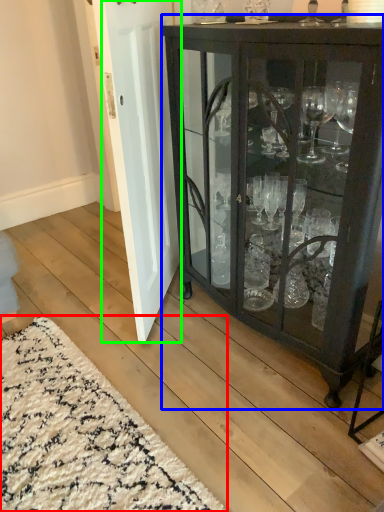
Question: Based on their relative distances, which object is farther from doormat (highlighted by a red box)? Choose from cupboard (highlighted by a blue box) and door (highlighted by a green box).

Choices:
 (A) cupboard
 (B) door

Answer: (A)